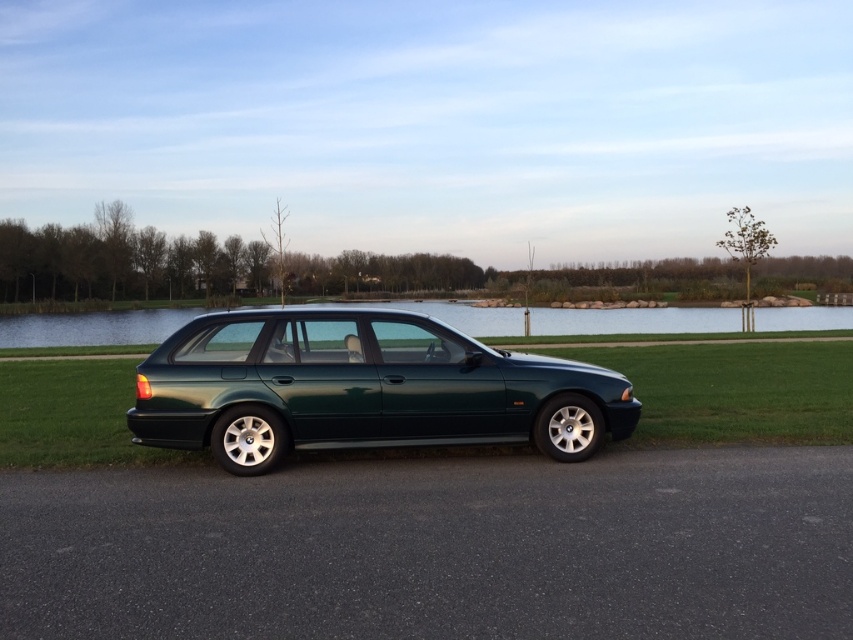
You are standing at the origin point in the image. The metallic green wagon at center is at point (363, 388). Can you determine the direction of the metallic green wagon at center from your current position?

The metallic green wagon at center is located at point (363, 388), which is to the right and slightly above your current position at the origin point.

You are a photographer trying to capture the metallic green wagon at center and the transparent glass water at center in a single shot. Based on their positions, which object would appear larger in the photo?

The metallic green wagon at center would appear larger in the photo because it is closer to the viewer than the transparent glass water at center.

You are a delivery drone with a maximum flight range of 50 meters. You need to deliver a package from the metallic green wagon at center to the transparent glass water at center. Can you complete the delivery without needing to recharge?

The distance between the metallic green wagon at center and the transparent glass water at center is 46.81 meters, which is within the drone s 50 meter range. Yes, the drone can complete the delivery without needing to recharge.